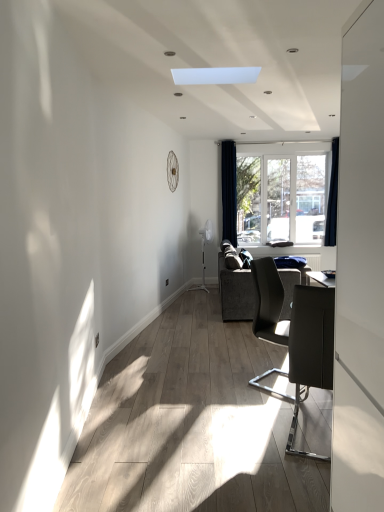
You are a GUI agent. You are given a task and a screenshot of the screen. Output one action in this format:
    pyautogui.click(x=<x>, y=<y>)
    Task: Click on the free space in front of matte black chair at center right, positioned as the first chair in back-to-front order
    This screenshot has width=384, height=512.
    Given the screenshot: What is the action you would take?
    pyautogui.click(x=271, y=403)